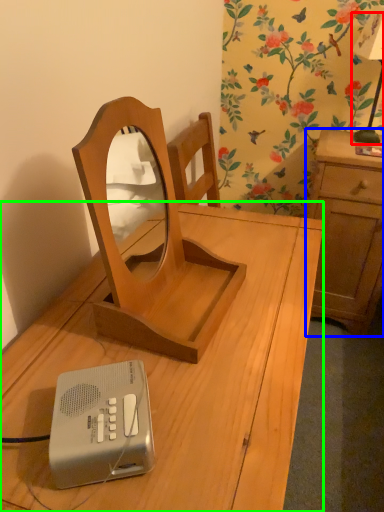
Question: Based on their relative distances, which object is nearer to bedside lamp (highlighted by a red box)? Choose from cabinetry (highlighted by a blue box) and desk (highlighted by a green box).

Choices:
 (A) cabinetry
 (B) desk

Answer: (A)